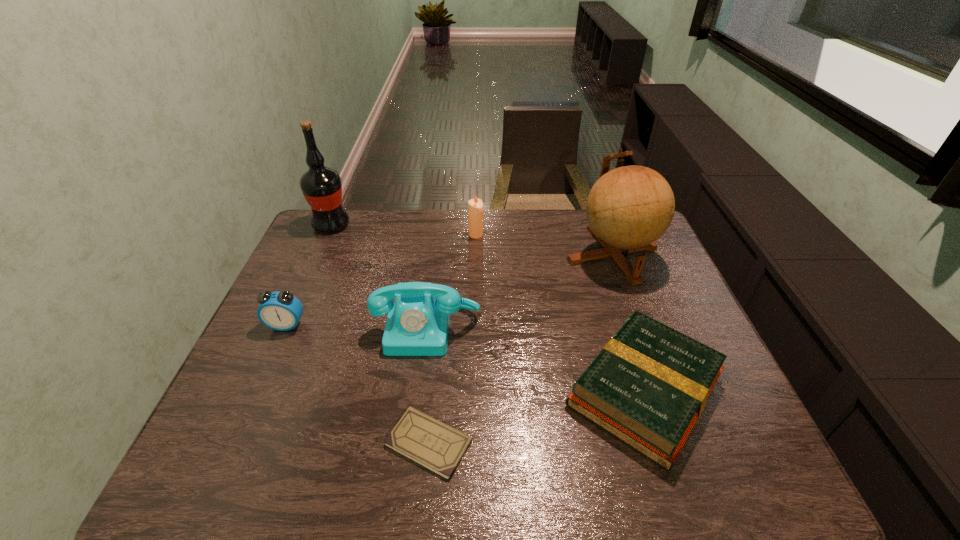
Locate an element on the screen. wine bottle is located at coordinates (321, 186).

Where is `globe`? Image resolution: width=960 pixels, height=540 pixels. globe is located at coordinates (628, 208).

The image size is (960, 540). Find the location of `telephone`. telephone is located at coordinates (417, 324).

Where is `candle`? This screenshot has height=540, width=960. candle is located at coordinates (475, 206).

Locate an element on the screen. This screenshot has height=540, width=960. alarm clock is located at coordinates (281, 311).

Find the location of a particular element. This screenshot has width=960, height=540. hardback book is located at coordinates (648, 386).

Locate an element on the screen. The image size is (960, 540). checkbook is located at coordinates (436, 446).

Identify the location of free space located on the right of the wine bottle. The image size is (960, 540). (429, 225).

The width and height of the screenshot is (960, 540). In order to click on vacant space located 0.280m on the surface of the globe in this screenshot , I will do `click(651, 360)`.

In order to click on free spot located 0.200m on the dial of the telephone in this screenshot , I will do `click(415, 429)`.